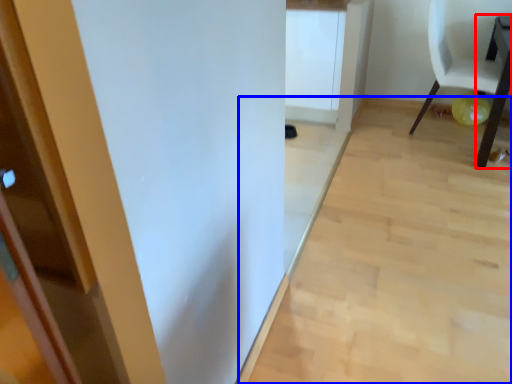
Question: Which of the following is the farthest to the observer, table (highlighted by a red box) or plain (highlighted by a blue box)?

Choices:
 (A) table
 (B) plain

Answer: (A)